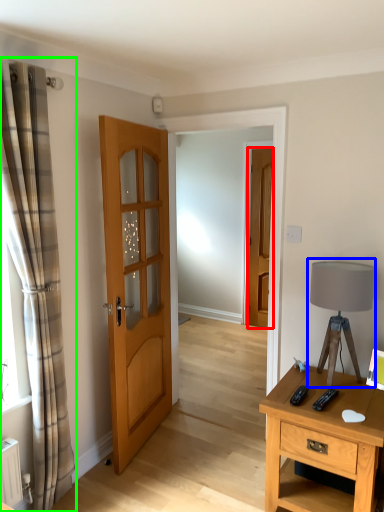
Question: Which is nearer to the door (highlighted by a red box)? table lamp (highlighted by a blue box) or curtain (highlighted by a green box).

Choices:
 (A) table lamp
 (B) curtain

Answer: (A)